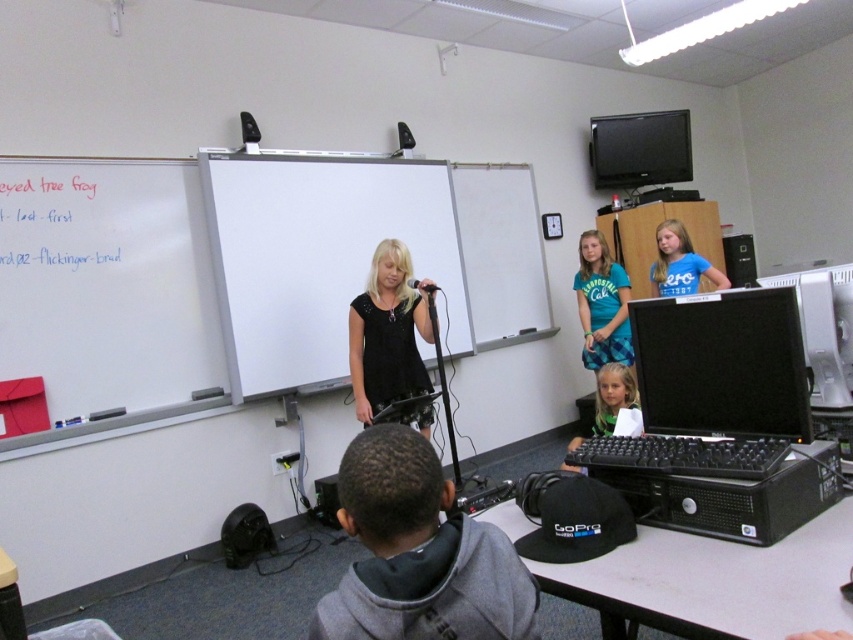
Between white plastic computer at right and blue t-shirt at upper right, which one is positioned higher?

blue t-shirt at upper right is above.

Who is more forward, (817, 390) or (669, 240)?

Positioned in front is point (817, 390).

I want to click on white plastic computer at right, so click(824, 330).

Between point (659, 285) and point (608, 429), which one is positioned in front?

Point (608, 429)

Does blue t-shirt at upper right appear under matte black keyboard at lower center?

No.

Between point (683, 260) and point (596, 401), which one is positioned in front?

Point (596, 401) is more forward.

Identify the location of blue t-shirt at upper right. (680, 262).

From the picture: Can you confirm if black matte dress at center is positioned below white plastic computer at right?

Correct, black matte dress at center is located below white plastic computer at right.

Does point (422, 282) lie behind point (815, 308)?

Yes.

Find the location of a particular element. Image resolution: width=853 pixels, height=640 pixels. black matte dress at center is located at coordinates (387, 333).